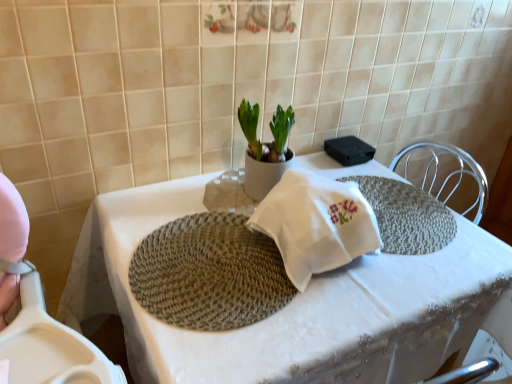
Image resolution: width=512 pixels, height=384 pixels. Find the location of `free space above rattan placemat at center (from a real-world perspective)`. free space above rattan placemat at center (from a real-world perspective) is located at coordinates (214, 263).